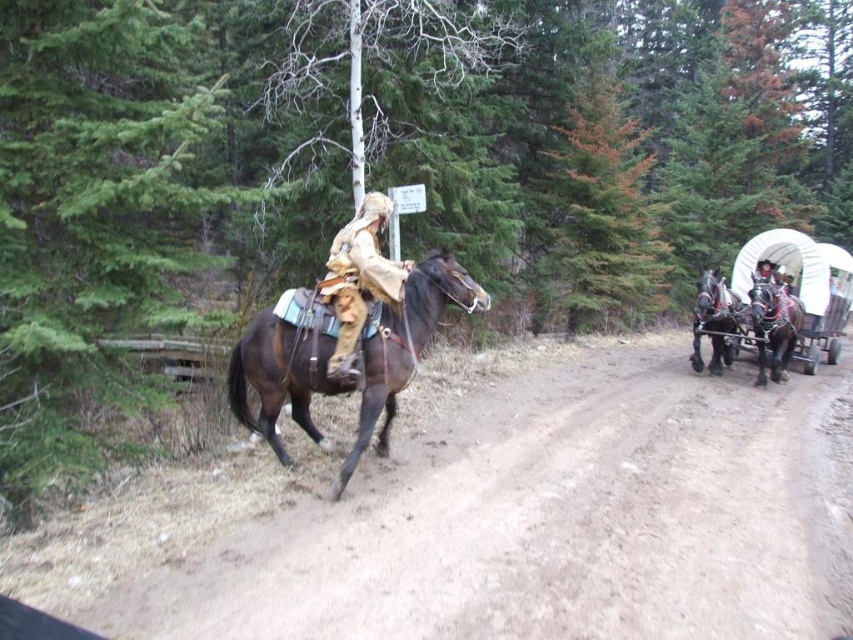
Identify the location of brown glossy horse at center. (329, 355).

Is the position of brown glossy horse at center more distant than that of shiny black horse at right?

No, it is not.

What do you see at coordinates (329, 355) in the screenshot? I see `brown glossy horse at center` at bounding box center [329, 355].

Find the location of a particular element. This screenshot has width=853, height=640. brown glossy horse at center is located at coordinates (329, 355).

Who is more distant from viewer, (280, 582) or (693, 336)?

Positioned behind is point (693, 336).

Is point (633, 365) closer to camera compared to point (704, 304)?

No, (633, 365) is further to viewer.

Who is more forward, (x=602, y=596) or (x=723, y=333)?

Point (x=602, y=596) is in front.

Where is `brown sandy dirt track at center`? brown sandy dirt track at center is located at coordinates (550, 522).

Can you confirm if tan suede jacket at center is thinner than shiny black horse at right?

Yes, tan suede jacket at center is thinner than shiny black horse at right.

Which is behind, point (346, 248) or point (767, 340)?

Positioned behind is point (767, 340).

Find the location of a particular element. Image resolution: width=853 pixels, height=640 pixels. tan suede jacket at center is located at coordinates (358, 280).